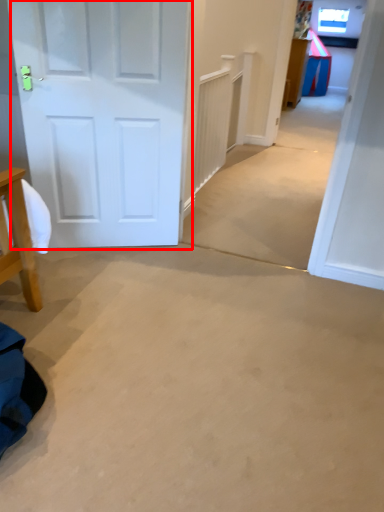
Question: Observing the image, what is the correct spatial positioning of door (annotated by the red box) in reference to table?

Choices:
 (A) left
 (B) right

Answer: (A)